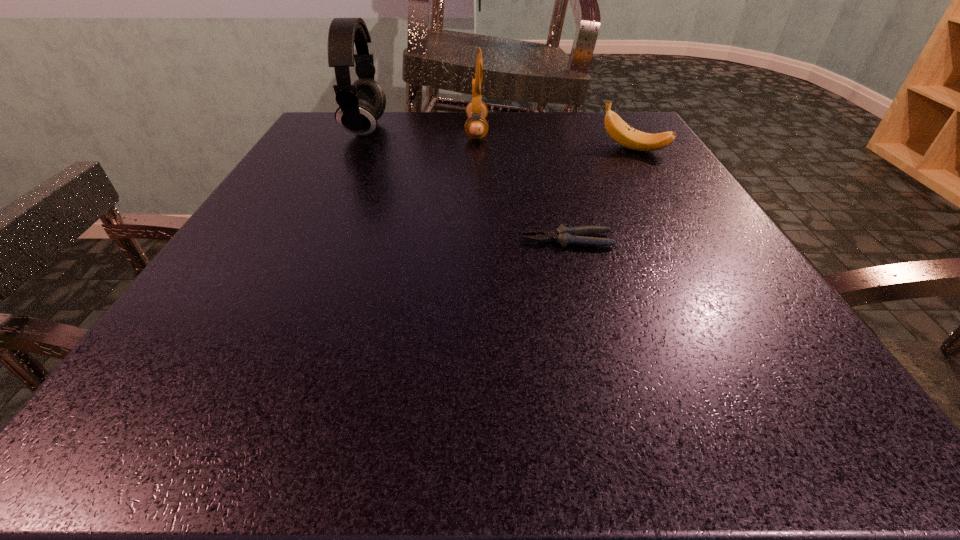
The image size is (960, 540). Find the location of `vacant area in the image that satisfies the following two spatial constraints: 1. on the back side of the third tallest object; 2. on the front-facing side of the right earphone`. vacant area in the image that satisfies the following two spatial constraints: 1. on the back side of the third tallest object; 2. on the front-facing side of the right earphone is located at coordinates (622, 131).

At what (x,y) coordinates should I click in order to perform the action: click on vacant point that satisfies the following two spatial constraints: 1. on the back side of the banana; 2. on the front-facing side of the right earphone. Please return your answer as a coordinate pair (x, y). Looking at the image, I should click on (622, 131).

Where is `vacant space that satisfies the following two spatial constraints: 1. on the front-facing side of the banana; 2. on the left side of the shorter earphone`? The height and width of the screenshot is (540, 960). vacant space that satisfies the following two spatial constraints: 1. on the front-facing side of the banana; 2. on the left side of the shorter earphone is located at coordinates (476, 149).